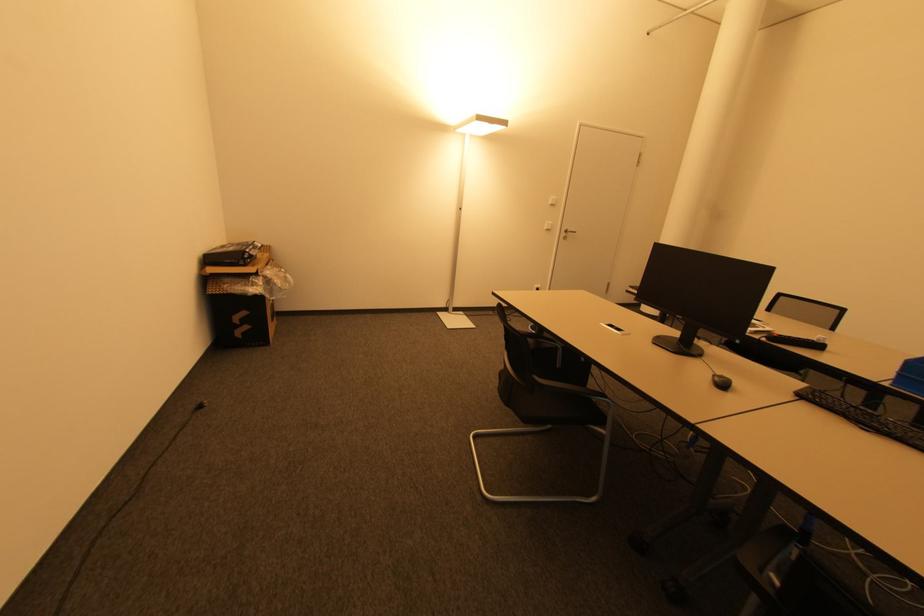
Find the location of a particular element. black smartphone is located at coordinates (796, 341).